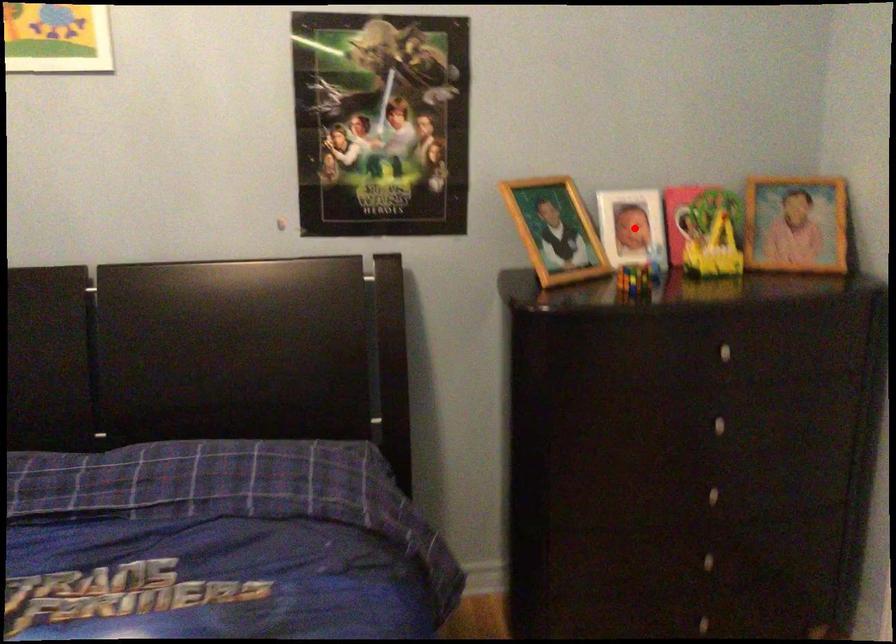
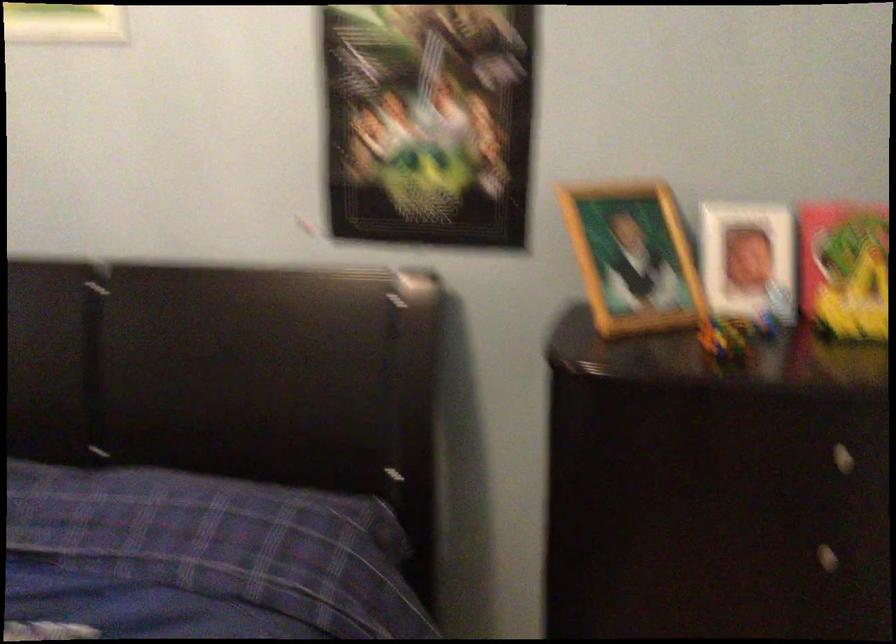
Question: A red point is marked in image1. In image2, is the corresponding 3D point closer to the camera or farther? Reply with the corresponding letter.

Choices:
 (A) The corresponding 3D point is closer.
 (B) The corresponding 3D point is farther.

Answer: (A)